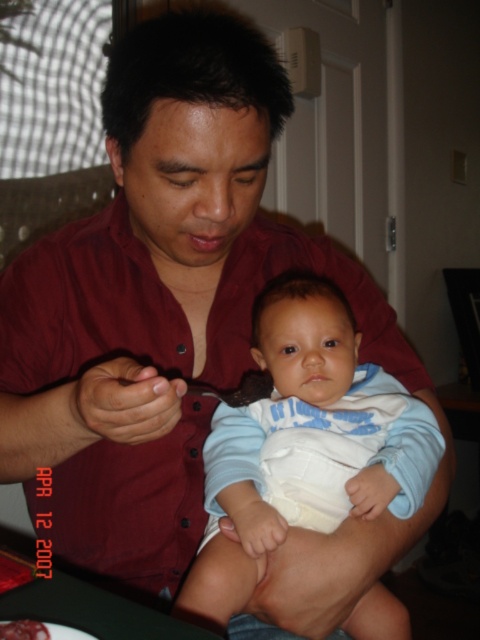
Is point (255, 339) positioned behind point (20, 620)?

Yes, it is.

Does point (305, 422) come in front of point (27, 627)?

No, it is not.

Does point (347, 468) come in front of point (12, 624)?

No, it is behind (12, 624).

Locate an element on the screen. light blue cotton onesie at center is located at coordinates (304, 444).